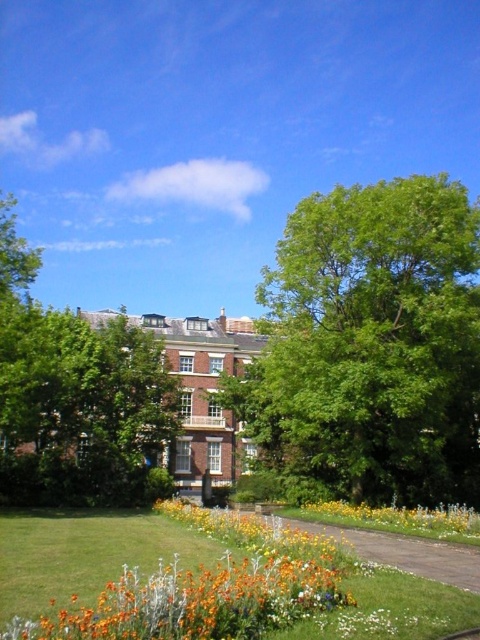
You are standing at the entrance of the building and want to locate the green leafy tree at center. According to the coordinates provided, in which direction should you look to find it?

The green leafy tree at center is located at coordinates point (372, 346). Since the coordinate system is not specified, but assuming standard image coordinates where x increases to the right and y increases downward, the tree would be positioned slightly to the right and lower half of the image. However, without explicit direction mapping, the exact direction cannot be determined beyond its central position.

You are standing in the garden looking at the green leafy tree at center. If you walk straight towards it, how many steps would you estimate to reach it, assuming each step covers about 2.5 feet?

The green leafy tree at center is 152.61 feet away. Dividing the distance by the step length of 2.5 feet gives approximately 61 steps. However, since you can only take whole steps, you would need about 61 steps to reach it.

You are standing at the entrance of the building and looking towards the garden. Which of the two green leafy trees is positioned to the right side when comparing the green leafy tree at center and the green leafy tree at upper center?

The green leafy tree at center is positioned to the right of the green leafy tree at upper center.